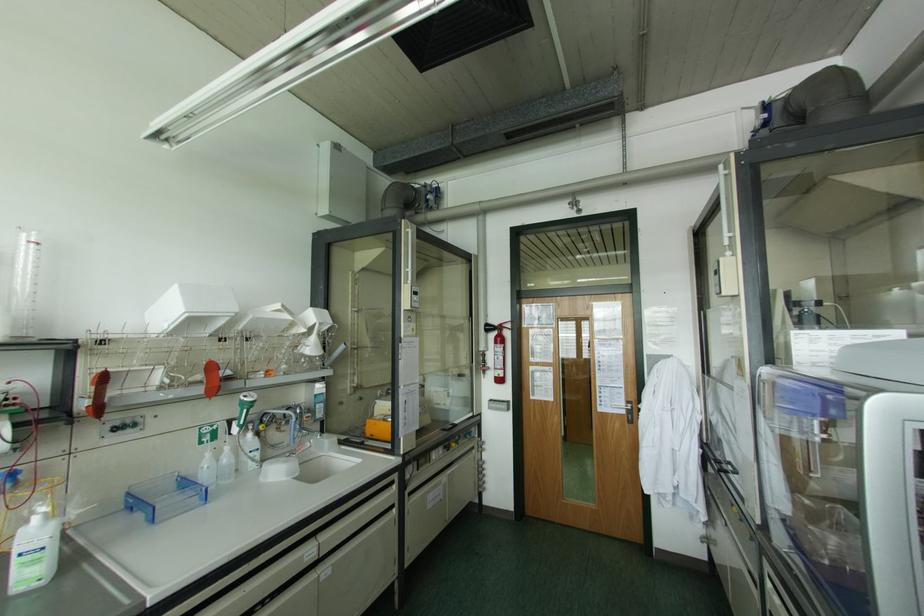
Locate an element on the screen. blue plastic tray is located at coordinates (164, 496).